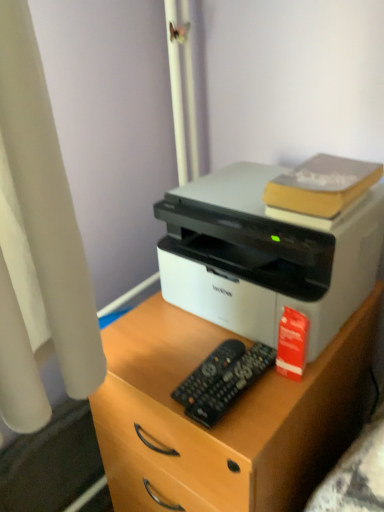
At what (x,y) coordinates should I click in order to perform the action: click on free space that is to the left of black plastic remote at center, the 1th control positioned from the front. Please return your answer as a coordinate pair (x, y). Image resolution: width=384 pixels, height=512 pixels. Looking at the image, I should click on (149, 371).